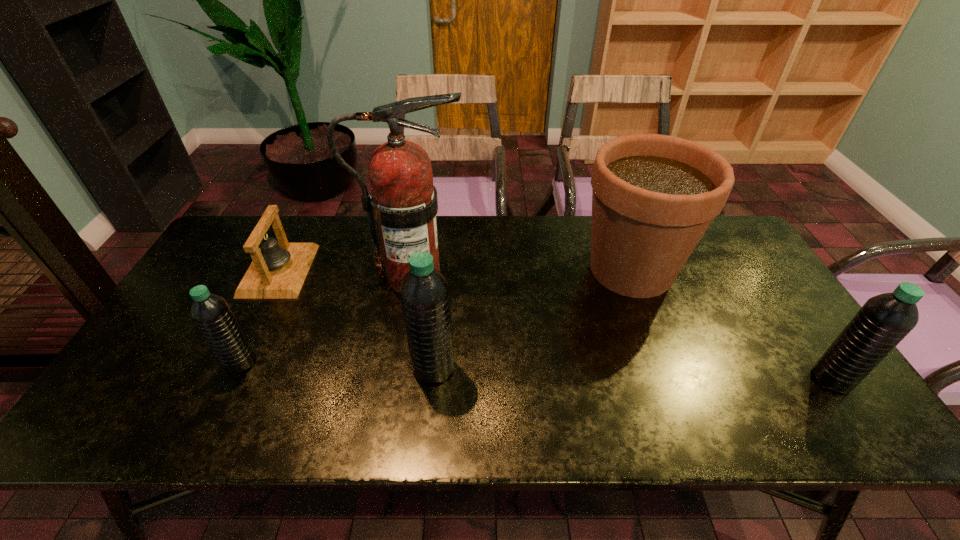
Image resolution: width=960 pixels, height=540 pixels. In order to click on vacant point located between the leftmost water bottle and the fire extinguisher in this screenshot , I will do `click(327, 319)`.

Locate an element on the screen. The image size is (960, 540). vacant area that lies between the fire extinguisher and the flowerpot is located at coordinates (522, 273).

Find the location of a particular element. This screenshot has width=960, height=540. empty space that is in between the bell and the fifth tallest object is located at coordinates (260, 316).

Find the location of a particular element. free space that is in between the shortest object and the second object from right to left is located at coordinates (455, 270).

What are the coordinates of `vacant space in between the flowerpot and the second shortest water bottle` in the screenshot? It's located at tap(732, 324).

What are the coordinates of `vacant area that lies between the fire extinguisher and the leftmost water bottle` in the screenshot? It's located at (327, 319).

The height and width of the screenshot is (540, 960). I want to click on vacant region between the flowerpot and the rightmost water bottle, so click(x=732, y=324).

Choose which object is the fourth nearest neighbor to the leftmost water bottle. Please provide its 2D coordinates. Your answer should be formatted as a tuple, i.e. [(x, y)], where the tuple contains the x and y coordinates of a point satisfying the conditions above.

[(653, 196)]

Where is `object that is the fourth closest to the rightmost object`? object that is the fourth closest to the rightmost object is located at coordinates (278, 270).

This screenshot has width=960, height=540. I want to click on water bottle that is the third closest to the shortest object, so click(884, 320).